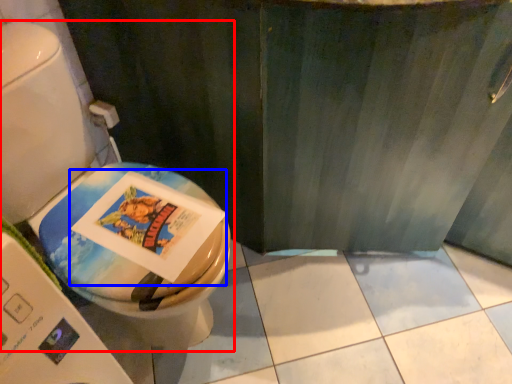
Question: Which object appears closest to the camera in this image, toilet (highlighted by a red box) or comic book (highlighted by a blue box)?

Choices:
 (A) toilet
 (B) comic book

Answer: (A)